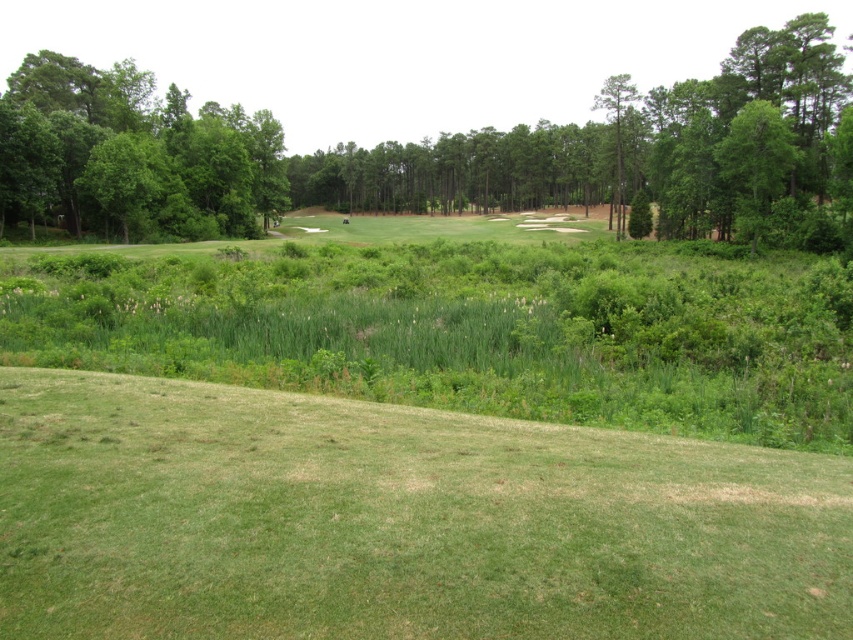
Question: In this image, where is green leafy tree at center located relative to green leafy tree at left?

Choices:
 (A) left
 (B) right

Answer: (B)

Question: Considering the relative positions of green grassy hill at lower center and green leafy tree at left in the image provided, where is green grassy hill at lower center located with respect to green leafy tree at left?

Choices:
 (A) left
 (B) right

Answer: (B)

Question: Among these points, which one is nearest to the camera?

Choices:
 (A) (466, 180)
 (B) (785, 509)
 (C) (108, 193)

Answer: (B)

Question: Among these points, which one is farthest from the camera?

Choices:
 (A) (526, 131)
 (B) (10, 122)

Answer: (A)

Question: Is green leafy tree at center to the left of green leafy tree at left from the viewer's perspective?

Choices:
 (A) yes
 (B) no

Answer: (B)

Question: Which point appears farthest from the camera in this image?

Choices:
 (A) (111, 81)
 (B) (218, 605)
 (C) (804, 99)

Answer: (A)